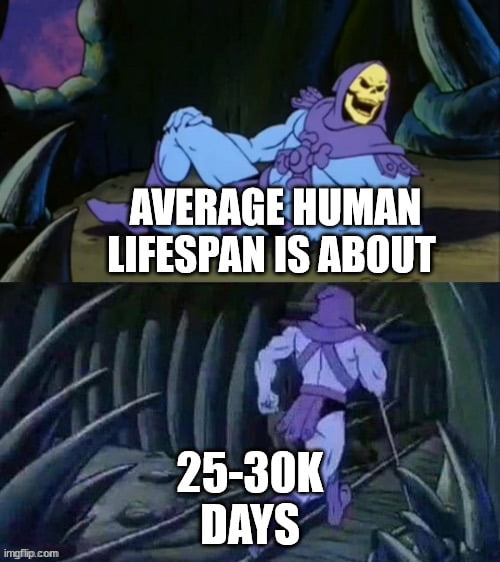
The height and width of the screenshot is (562, 500). I want to click on window, so click(38, 92).